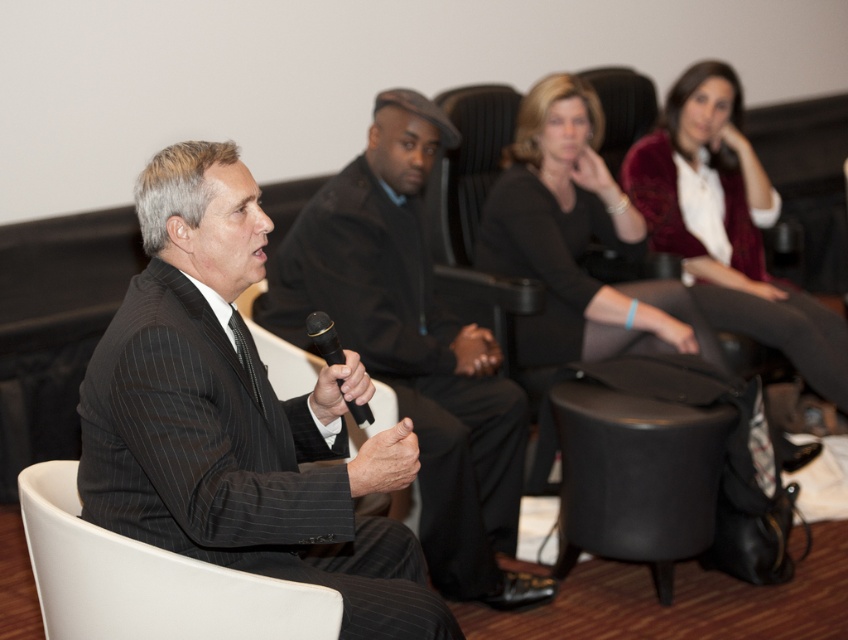
Measure the distance between point (651, 540) and camera.

Point (651, 540) is 8.78 feet from camera.

Measure the distance between point (637,388) and camera.

2.74 meters

I want to click on black leather stool at lower center, so click(x=636, y=460).

Does dark gray pinstripe suit at center have a greater width compared to black plastic microphone at center?

Indeed, dark gray pinstripe suit at center has a greater width compared to black plastic microphone at center.

Who is more forward, (456,419) or (333,340)?

Positioned in front is point (333,340).

The image size is (848, 640). I want to click on dark gray pinstripe suit at center, so click(x=416, y=348).

I want to click on dark gray pinstripe suit at center, so click(x=416, y=348).

Between matte black suit at center and white plastic chair at lower left, which one appears on the left side from the viewer's perspective?

white plastic chair at lower left is more to the left.

Between matte black suit at center and white plastic chair at lower left, which one is positioned higher?

matte black suit at center is higher up.

Which is behind, point (299, 481) or point (216, 625)?

The point (216, 625) is behind.

What are the coordinates of `matte black suit at center` in the screenshot? It's located at (238, 419).